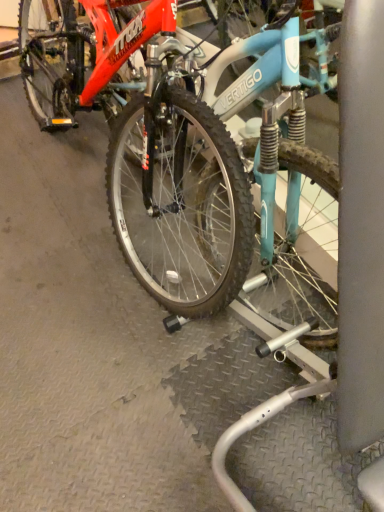
Describe the element at coordinates (229, 175) in the screenshot. The height and width of the screenshot is (512, 384). I see `teal matte bicycle at center` at that location.

Identify the location of teal matte bicycle at center. (229, 175).

You are a GUI agent. You are given a task and a screenshot of the screen. Output one action in this format:
    pyautogui.click(x=<x>, y=<y>)
    Task: Click on the teal matte bicycle at center
    The image size is (384, 512).
    Given the screenshot: What is the action you would take?
    pyautogui.click(x=229, y=175)